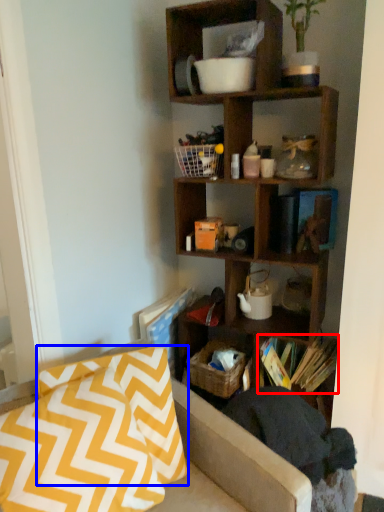
Question: Which object appears farthest to the camera in this image, book (highlighted by a red box) or pillow (highlighted by a blue box)?

Choices:
 (A) book
 (B) pillow

Answer: (A)